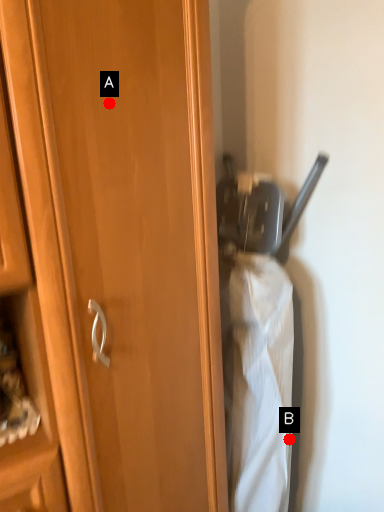
Question: Two points are circled on the image, labeled by A and B beside each circle. Which point appears farthest from the camera in this image?

Choices:
 (A) A is further
 (B) B is further

Answer: (B)